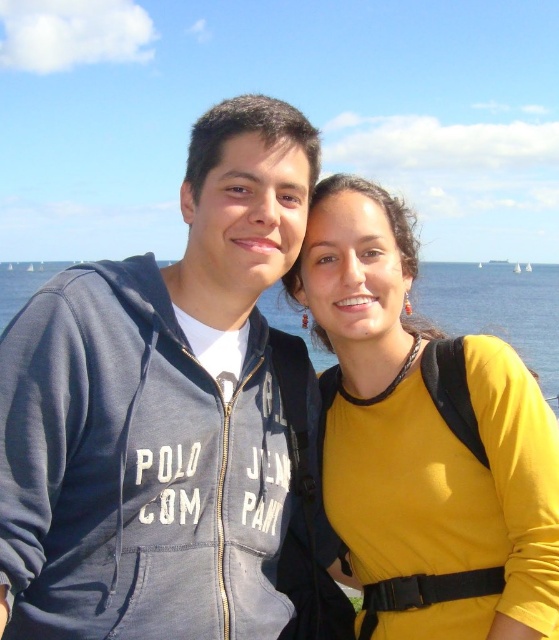
Question: Which object is closer to the camera taking this photo?

Choices:
 (A) white sailboat at center
 (B) dark blue zip-up hoodie at center
 (C) blue water at center
 (D) yellow matte shirt at center

Answer: (B)

Question: Which object appears farthest from the camera in this image?

Choices:
 (A) dark blue zip-up hoodie at center
 (B) yellow matte shirt at center

Answer: (B)

Question: Is dark blue zip-up hoodie at center to the left of blue water at center from the viewer's perspective?

Choices:
 (A) no
 (B) yes

Answer: (B)

Question: Does dark blue zip-up hoodie at center appear on the right side of blue water at center?

Choices:
 (A) yes
 (B) no

Answer: (B)

Question: Which object is positioned farthest from the blue water at center?

Choices:
 (A) yellow matte shirt at center
 (B) dark blue zip-up hoodie at center

Answer: (B)

Question: Does yellow matte shirt at center appear over white sailboat at center?

Choices:
 (A) no
 (B) yes

Answer: (A)